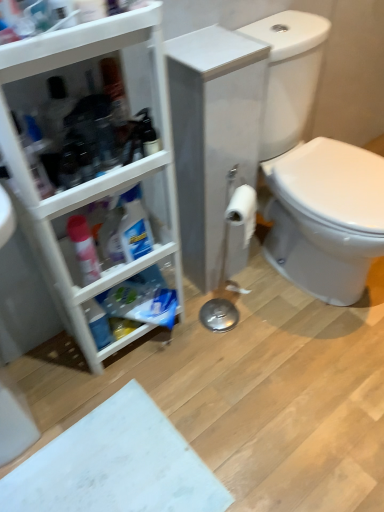
Question: Is white glossy toilet at right far from translucent plastic spray bottle at left?

Choices:
 (A) yes
 (B) no

Answer: (B)

Question: Can you confirm if white glossy toilet at right is bigger than translucent plastic spray bottle at left?

Choices:
 (A) no
 (B) yes

Answer: (B)

Question: Is white glossy toilet at right shorter than translucent plastic spray bottle at left?

Choices:
 (A) yes
 (B) no

Answer: (B)

Question: Is white glossy toilet at right not within translucent plastic spray bottle at left?

Choices:
 (A) no
 (B) yes

Answer: (B)

Question: Considering the relative sizes of white glossy toilet at right and translucent plastic spray bottle at left in the image provided, is white glossy toilet at right wider than translucent plastic spray bottle at left?

Choices:
 (A) yes
 (B) no

Answer: (A)

Question: From a real-world perspective, is white glossy toilet at right located higher than translucent plastic spray bottle at left?

Choices:
 (A) yes
 (B) no

Answer: (B)

Question: Could you tell me if white matte toilet paper at center is facing translucent plastic spray bottle at left?

Choices:
 (A) yes
 (B) no

Answer: (B)

Question: From a real-world perspective, does white matte toilet paper at center sit lower than translucent plastic spray bottle at left?

Choices:
 (A) no
 (B) yes

Answer: (B)

Question: Is there a large distance between white matte toilet paper at center and translucent plastic spray bottle at left?

Choices:
 (A) no
 (B) yes

Answer: (A)

Question: Considering the relative sizes of white matte toilet paper at center and translucent plastic spray bottle at left in the image provided, is white matte toilet paper at center smaller than translucent plastic spray bottle at left?

Choices:
 (A) yes
 (B) no

Answer: (B)

Question: Can you confirm if white matte toilet paper at center is shorter than translucent plastic spray bottle at left?

Choices:
 (A) no
 (B) yes

Answer: (A)

Question: Is white matte toilet paper at center positioned beyond the bounds of translucent plastic spray bottle at left?

Choices:
 (A) no
 (B) yes

Answer: (B)

Question: From a real-world perspective, is white plastic cabinet at left located beneath white matte toilet paper at center?

Choices:
 (A) yes
 (B) no

Answer: (B)